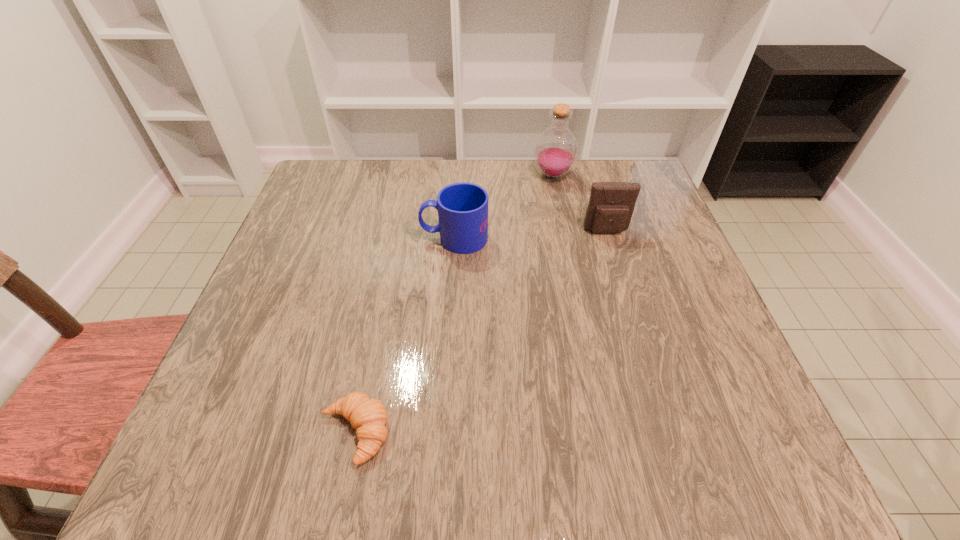
Identify the location of bottle. (556, 149).

At what (x,y) coordinates should I click in order to perform the action: click on the farthest object. Please return your answer as a coordinate pair (x, y). Image resolution: width=960 pixels, height=540 pixels. Looking at the image, I should click on (556, 149).

You are a GUI agent. You are given a task and a screenshot of the screen. Output one action in this format:
    pyautogui.click(x=<x>, y=<y>)
    Task: Click on the pouch
    This screenshot has height=540, width=960.
    Given the screenshot: What is the action you would take?
    pyautogui.click(x=611, y=205)

The width and height of the screenshot is (960, 540). I want to click on mug, so click(x=462, y=208).

Locate an element on the screen. This screenshot has width=960, height=540. the nearest object is located at coordinates (368, 416).

I want to click on crescent roll, so click(368, 416).

Identify the location of vacant area situated 0.220m on the front of the farthest object. The height and width of the screenshot is (540, 960). (566, 241).

At what (x,y) coordinates should I click in order to perform the action: click on free point located 0.380m with an open flap on the pouch. Please return your answer as a coordinate pair (x, y). The image size is (960, 540). Looking at the image, I should click on (652, 380).

This screenshot has width=960, height=540. Identify the location of free spot located 0.160m on the side with the handle of the third object from right to left. (352, 238).

Find the location of a particular element. Image resolution: width=960 pixels, height=540 pixels. free space located on the side with the handle of the third object from right to left is located at coordinates (331, 238).